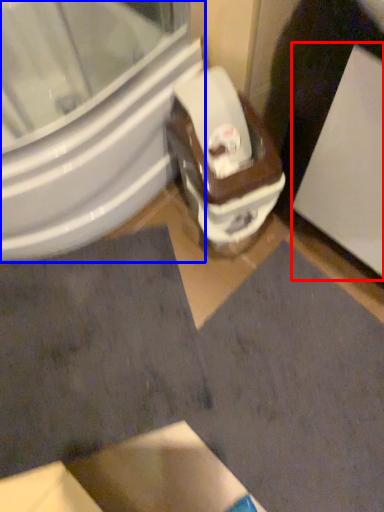
Question: Which of the following is the closest to the observer, screen door (highlighted by a red box) or bidet (highlighted by a blue box)?

Choices:
 (A) screen door
 (B) bidet

Answer: (A)